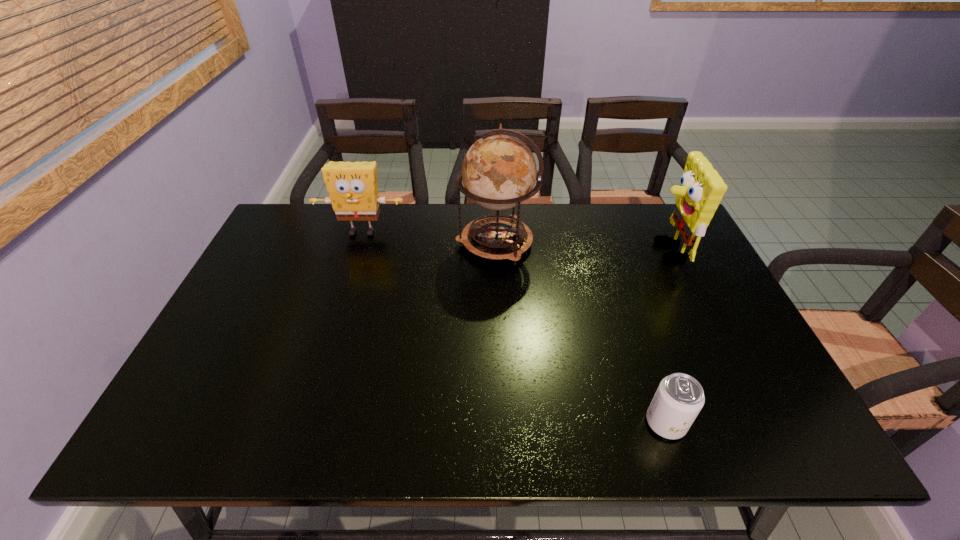
I want to click on object present at the far left corner, so click(352, 186).

Where is `object that is at the far right corner`? The image size is (960, 540). object that is at the far right corner is located at coordinates (701, 189).

The height and width of the screenshot is (540, 960). In the image, there is a desktop. What are the coordinates of `vacant space at the far edge` in the screenshot? It's located at tap(596, 217).

Where is `free region at the near edge of the desktop`? free region at the near edge of the desktop is located at coordinates (644, 421).

Locate an element on the screen. The height and width of the screenshot is (540, 960). vacant space at the left edge is located at coordinates (237, 370).

You are a GUI agent. You are given a task and a screenshot of the screen. Output one action in this format:
    pyautogui.click(x=<x>, y=<y>)
    Task: Click on the vacant space at the right edge of the desktop
    The height and width of the screenshot is (540, 960).
    Given the screenshot: What is the action you would take?
    pyautogui.click(x=728, y=311)

Image resolution: width=960 pixels, height=540 pixels. Find the location of `free point at the far left corner`. free point at the far left corner is located at coordinates 317,221.

I want to click on vacant region at the far right corner of the desktop, so click(653, 232).

At what (x,y) coordinates should I click in order to perform the action: click on empty space between the second shortest object and the nearest object. Please return your answer as a coordinate pair (x, y). The height and width of the screenshot is (540, 960). Looking at the image, I should click on (514, 327).

You are a GUI agent. You are given a task and a screenshot of the screen. Output one action in this format:
    pyautogui.click(x=<x>, y=<y>)
    Task: Click on the vacant region between the third object from right to left and the taller sponge
    
    Given the screenshot: What is the action you would take?
    pyautogui.click(x=581, y=247)